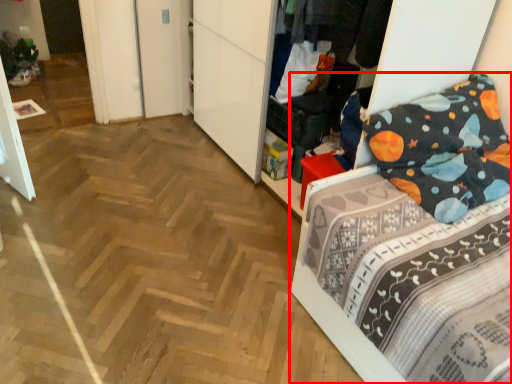
Question: From the image's perspective, what is the correct spatial relationship of bed (annotated by the red box) in relation to clothing?

Choices:
 (A) above
 (B) below

Answer: (B)